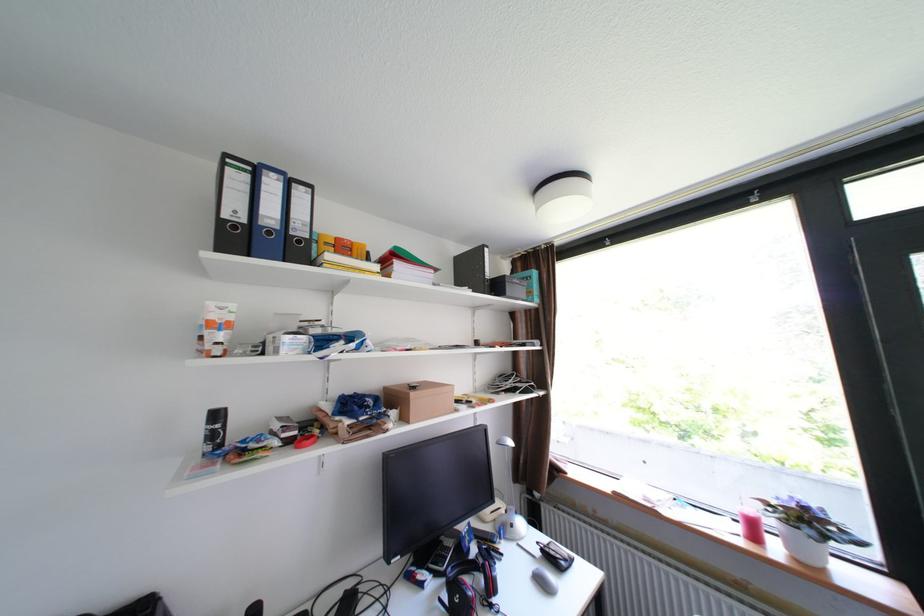
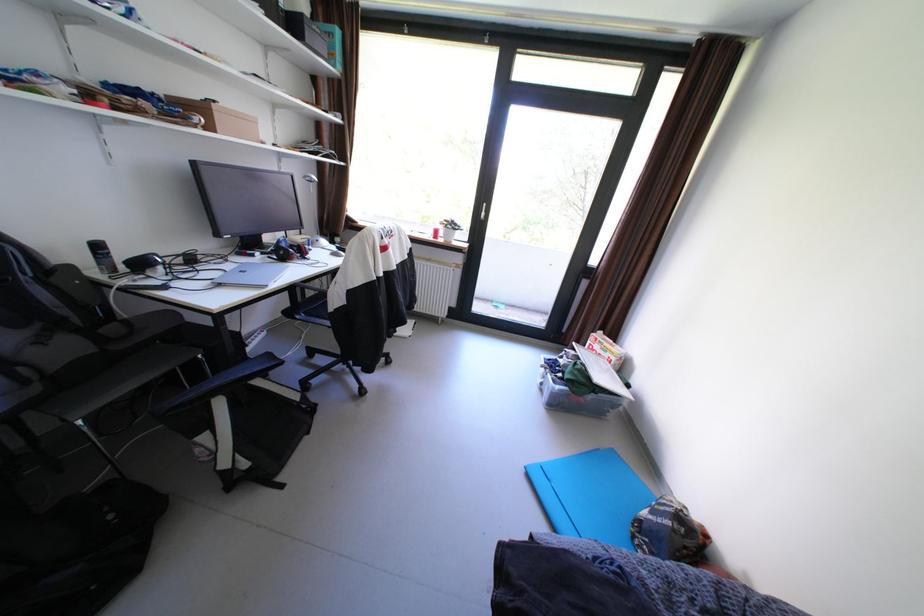
Locate, in the second image, the point that corresponds to the point at 446,576 in the first image.

(274, 254)